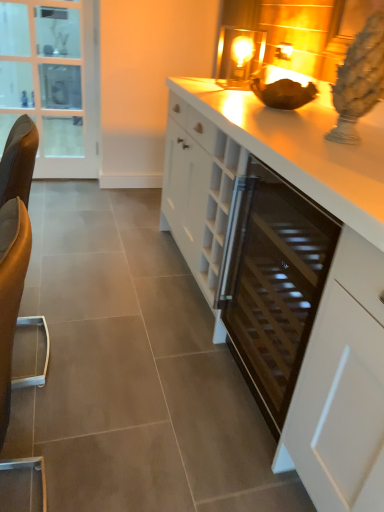
Question: From a real-world perspective, is white matte cabinet at center above or below clear glass door at left?

Choices:
 (A) below
 (B) above

Answer: (A)

Question: Considering the positions of point [x=354, y=261] and point [x=1, y=138], is point [x=354, y=261] closer or farther from the camera than point [x=1, y=138]?

Choices:
 (A) closer
 (B) farther

Answer: (A)

Question: Based on their relative distances, which object is nearer to the white glossy countertop at center?

Choices:
 (A) clear glass door at left
 (B) black glass wine cooler at center
 (C) brown leather swivel chair at left
 (D) white matte cabinet at center

Answer: (B)

Question: Estimate the real-world distances between objects in this image. Which object is closer to the black glass wine cooler at center?

Choices:
 (A) clear glass door at left
 (B) white glossy countertop at center
 (C) brown leather swivel chair at left
 (D) white matte cabinet at center

Answer: (D)